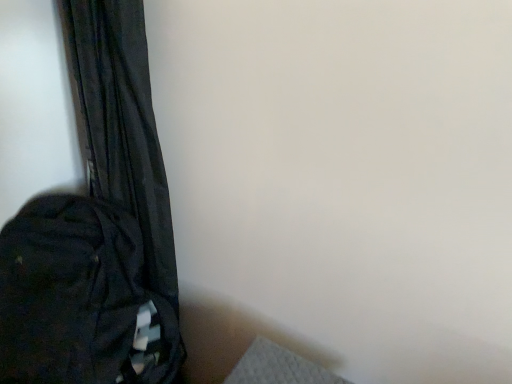
Question: Is black fabric curtain at left oriented away from black fabric backpack at lower left?

Choices:
 (A) no
 (B) yes

Answer: (B)

Question: Does black fabric curtain at left lie in front of black fabric backpack at lower left?

Choices:
 (A) no
 (B) yes

Answer: (A)

Question: Is black fabric curtain at left not near black fabric backpack at lower left?

Choices:
 (A) yes
 (B) no

Answer: (B)

Question: Does black fabric curtain at left have a lesser height compared to black fabric backpack at lower left?

Choices:
 (A) yes
 (B) no

Answer: (B)

Question: From the image's perspective, does black fabric curtain at left appear lower than black fabric backpack at lower left?

Choices:
 (A) yes
 (B) no

Answer: (B)

Question: From a real-world perspective, does black fabric curtain at left sit lower than black fabric backpack at lower left?

Choices:
 (A) no
 (B) yes

Answer: (A)

Question: Is black fabric backpack at lower left bigger than black fabric curtain at left?

Choices:
 (A) yes
 (B) no

Answer: (A)

Question: From a real-world perspective, does black fabric backpack at lower left sit lower than black fabric curtain at left?

Choices:
 (A) yes
 (B) no

Answer: (A)

Question: Does black fabric backpack at lower left have a lesser height compared to black fabric curtain at left?

Choices:
 (A) yes
 (B) no

Answer: (A)

Question: From the image's perspective, would you say black fabric backpack at lower left is shown under black fabric curtain at left?

Choices:
 (A) no
 (B) yes

Answer: (B)

Question: From a real-world perspective, is black fabric backpack at lower left on top of black fabric curtain at left?

Choices:
 (A) no
 (B) yes

Answer: (A)

Question: Does black fabric backpack at lower left have a greater height compared to black fabric curtain at left?

Choices:
 (A) yes
 (B) no

Answer: (B)

Question: From a real-world perspective, is black fabric backpack at lower left positioned above or below black fabric curtain at left?

Choices:
 (A) below
 (B) above

Answer: (A)